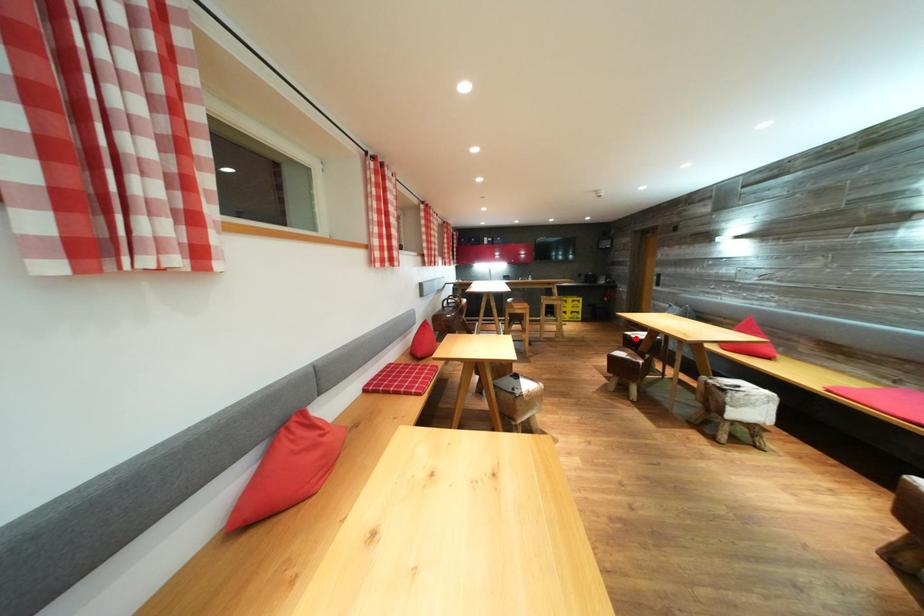
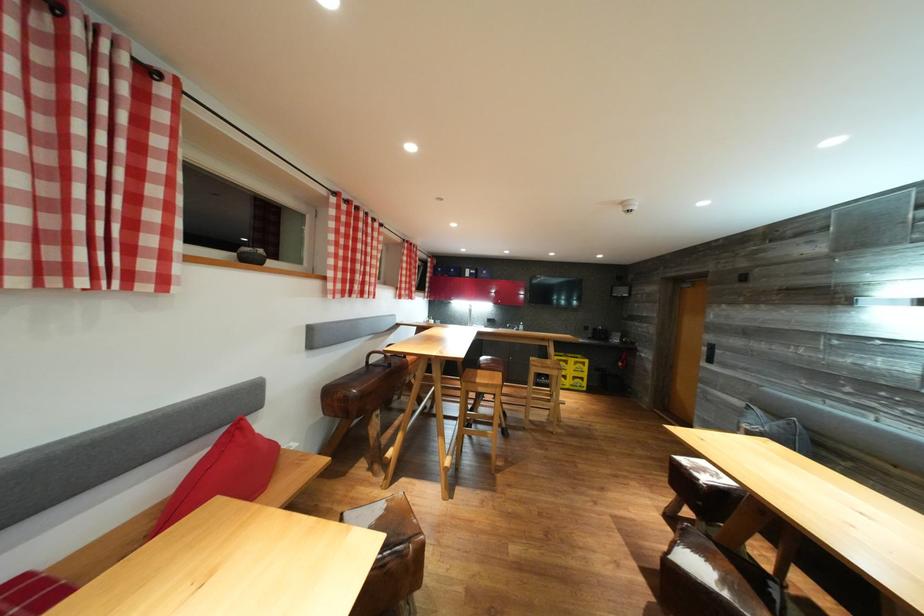
Find the pixel in the second image that matches the highlighted location in the first image.

(689, 466)